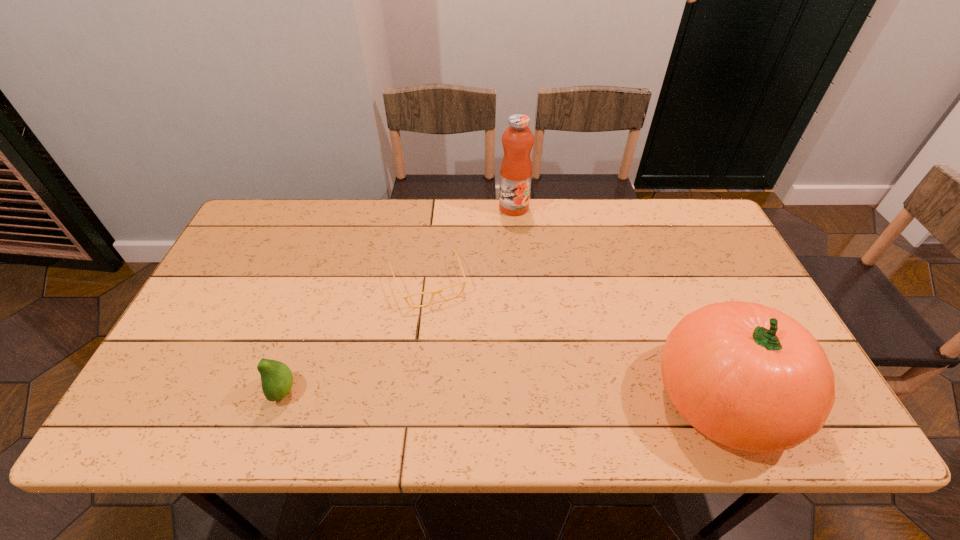
In order to click on vacant point that satisfies the following two spatial constraints: 1. on the front side of the rightmost object; 2. on the right side of the third nearest object in this screenshot , I will do `click(416, 398)`.

You are a GUI agent. You are given a task and a screenshot of the screen. Output one action in this format:
    pyautogui.click(x=<x>, y=<y>)
    Task: Click on the vacant region that satisfies the following two spatial constraints: 1. on the back side of the fruit juice; 2. on the right side of the third object from right to left
    
    Given the screenshot: What is the action you would take?
    pyautogui.click(x=437, y=207)